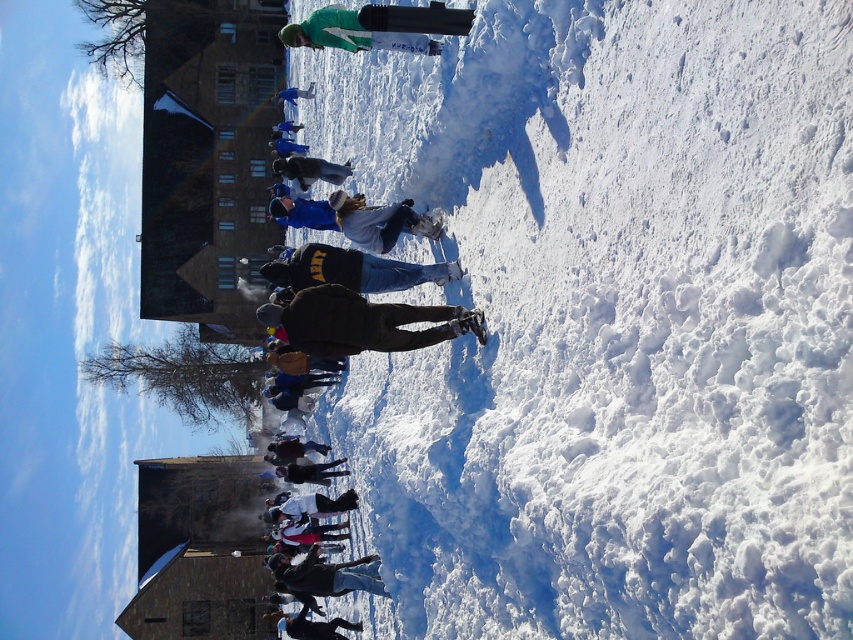
Who is shorter, blue fabric jacket at center or matte blue jacket at center?

blue fabric jacket at center

Can you confirm if blue fabric jacket at center is positioned below matte blue jacket at center?

Indeed, blue fabric jacket at center is positioned under matte blue jacket at center.

Describe the element at coordinates (374, 221) in the screenshot. The image size is (853, 640). I see `blue fabric jacket at center` at that location.

This screenshot has width=853, height=640. Find the location of `blue fabric jacket at center`. blue fabric jacket at center is located at coordinates (374, 221).

Describe the element at coordinates (363, 323) in the screenshot. I see `dark brown jacket at center` at that location.

Can you confirm if dark brown jacket at center is smaller than blue fabric jacket at center?

Yes.

The height and width of the screenshot is (640, 853). In order to click on dark brown jacket at center in this screenshot , I will do `click(363, 323)`.

Is dark brown jacket at center positioned before matte blue jacket at center?

Yes, dark brown jacket at center is in front of matte blue jacket at center.

Looking at this image, between dark brown jacket at center and matte blue jacket at center, which one is positioned higher?

matte blue jacket at center is higher up.

Measure the distance between point (407, 333) and camera.

Point (407, 333) and camera are 184.79 feet apart.

Image resolution: width=853 pixels, height=640 pixels. In order to click on dark brown jacket at center in this screenshot , I will do `click(363, 323)`.